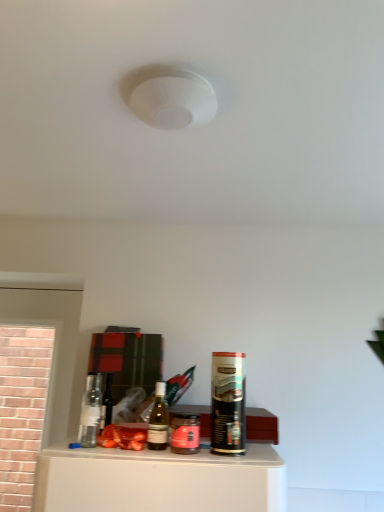
Question: Does translucent glass bottle at center turn towards pink glass jar at center, which is counted as the 1th beverage, starting from the left?

Choices:
 (A) no
 (B) yes

Answer: (A)

Question: From a real-world perspective, is translucent glass bottle at center physically below pink glass jar at center, which is counted as the 1th beverage, starting from the left?

Choices:
 (A) yes
 (B) no

Answer: (B)

Question: From the image's perspective, would you say translucent glass bottle at center is shown under pink glass jar at center, which appears as the 2th beverage when viewed from the right?

Choices:
 (A) no
 (B) yes

Answer: (A)

Question: Is translucent glass bottle at center positioned with its back to pink glass jar at center, which appears as the 2th beverage when viewed from the right?

Choices:
 (A) yes
 (B) no

Answer: (B)

Question: From the image's perspective, is translucent glass bottle at center on top of pink glass jar at center, which appears as the 2th beverage when viewed from the right?

Choices:
 (A) yes
 (B) no

Answer: (A)

Question: Considering the relative sizes of translucent glass bottle at center and pink glass jar at center, which appears as the 2th beverage when viewed from the right, in the image provided, is translucent glass bottle at center thinner than pink glass jar at center, which appears as the 2th beverage when viewed from the right,?

Choices:
 (A) yes
 (B) no

Answer: (A)

Question: Considering the relative positions of black matte spray can at right, placed as the first beverage when sorted from right to left, and pink glass jar at center, which appears as the 2th beverage when viewed from the right, in the image provided, is black matte spray can at right, placed as the first beverage when sorted from right to left, to the left of pink glass jar at center, which appears as the 2th beverage when viewed from the right, from the viewer's perspective?

Choices:
 (A) no
 (B) yes

Answer: (A)

Question: Is the depth of black matte spray can at right, arranged as the 2th beverage when viewed from the left, greater than that of pink glass jar at center, which is counted as the 1th beverage, starting from the left?

Choices:
 (A) yes
 (B) no

Answer: (B)

Question: Does black matte spray can at right, arranged as the 2th beverage when viewed from the left, have a lesser height compared to pink glass jar at center, which appears as the 2th beverage when viewed from the right?

Choices:
 (A) no
 (B) yes

Answer: (A)

Question: Would you say black matte spray can at right, placed as the first beverage when sorted from right to left, is a long distance from pink glass jar at center, which is counted as the 1th beverage, starting from the left?

Choices:
 (A) yes
 (B) no

Answer: (B)

Question: Is black matte spray can at right, placed as the first beverage when sorted from right to left, outside pink glass jar at center, which is counted as the 1th beverage, starting from the left?

Choices:
 (A) yes
 (B) no

Answer: (A)

Question: Is black matte spray can at right, arranged as the 2th beverage when viewed from the left, looking in the opposite direction of pink glass jar at center, which appears as the 2th beverage when viewed from the right?

Choices:
 (A) yes
 (B) no

Answer: (B)

Question: Is pink glass jar at center, which appears as the 2th beverage when viewed from the right, inside matte glass wine bottle at center?

Choices:
 (A) no
 (B) yes

Answer: (A)